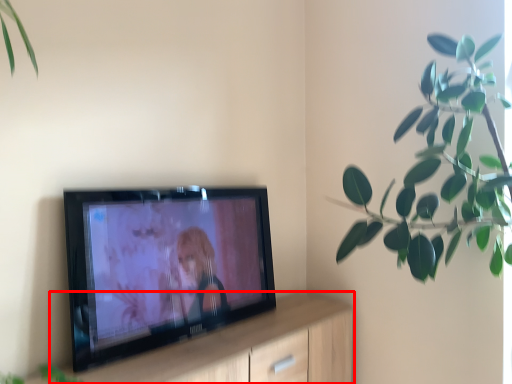
Question: From the image's perspective, considering the relative positions of dresser (annotated by the red box) and houseplant in the image provided, where is dresser (annotated by the red box) located with respect to the staircase?

Choices:
 (A) below
 (B) above

Answer: (A)